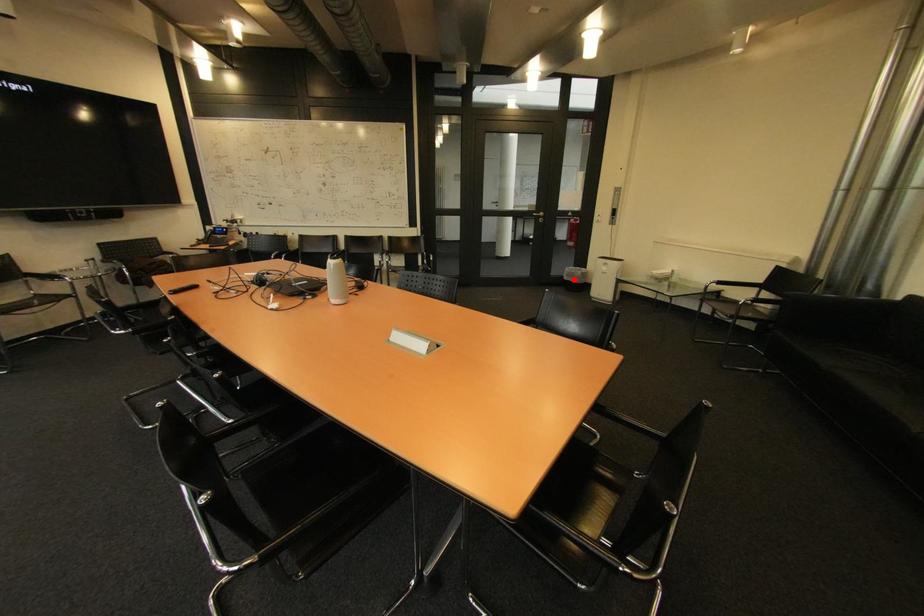
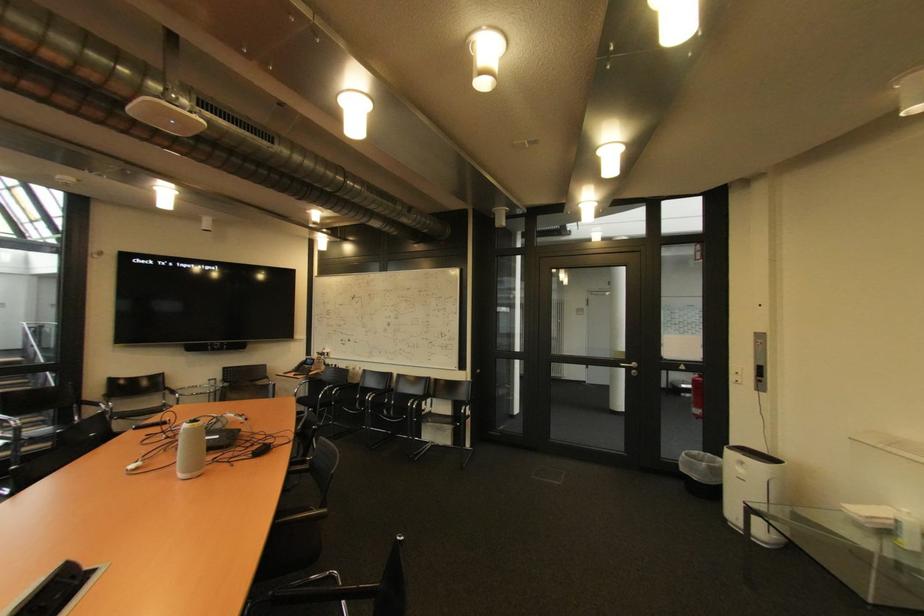
Question: I am providing you with two images of the same scene from different viewpoints. A red point is marked on the first image. Can you still see the location of the red point in image 2?

Choices:
 (A) Yes
 (B) No

Answer: (A)